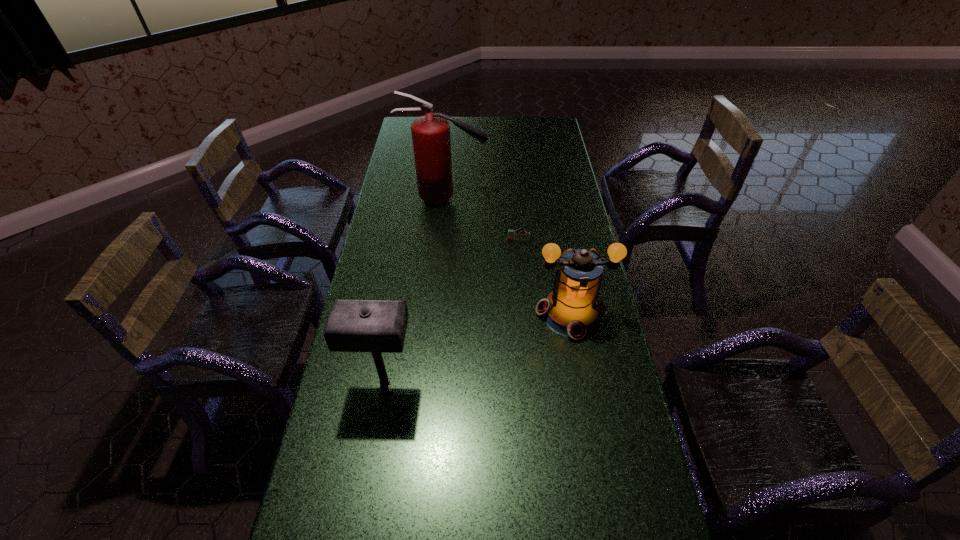
Locate an element on the screen. This screenshot has height=540, width=960. the tallest object is located at coordinates (431, 141).

Where is `the farthest object`? The width and height of the screenshot is (960, 540). the farthest object is located at coordinates (431, 141).

The width and height of the screenshot is (960, 540). I want to click on the second tallest object, so click(x=378, y=326).

This screenshot has height=540, width=960. I want to click on mallet, so click(x=378, y=326).

Locate an element on the screen. The width and height of the screenshot is (960, 540). lantern is located at coordinates (573, 308).

I want to click on the second nearest object, so click(573, 308).

Identify the location of the second farthest object. (512, 233).

Locate an element on the screen. This screenshot has width=960, height=540. stapler is located at coordinates (512, 233).

You are a GUI agent. You are given a task and a screenshot of the screen. Output one action in this format:
    pyautogui.click(x=<x>, y=<y>)
    Task: Click on the vacant space located 0.330m at the nozzle of the tallest object
    
    Given the screenshot: What is the action you would take?
    pyautogui.click(x=566, y=198)

Identify the location of free location located on the back of the third shortest object. This screenshot has width=960, height=540. (402, 276).